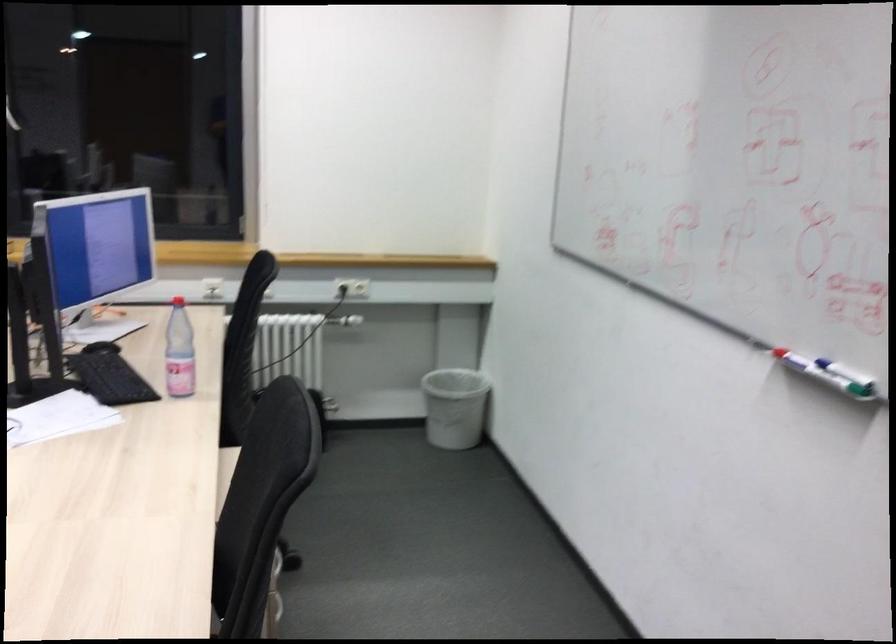
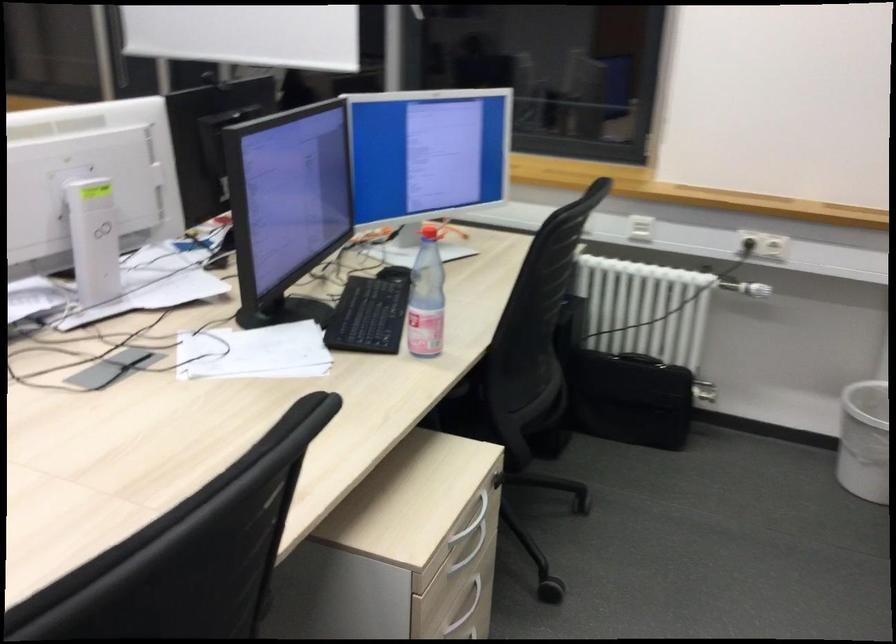
Question: The camera is either moving clockwise (left) or counter-clockwise (right) around the object. The first image is from the beginning of the video and the second image is from the end. Is the camera moving left or right when shooting the video?

Choices:
 (A) Left
 (B) Right

Answer: (B)